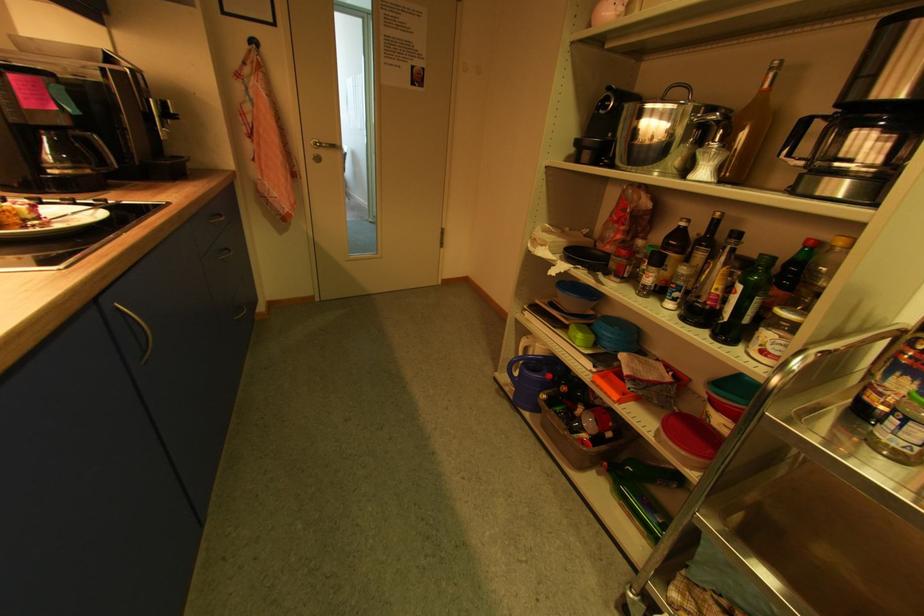
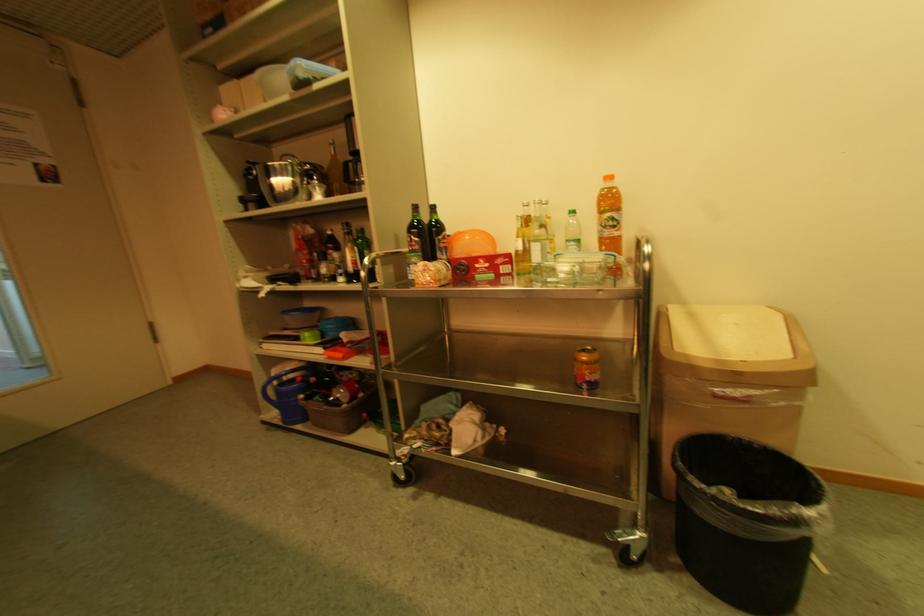
Question: The camera is either moving clockwise (left) or counter-clockwise (right) around the object. The first image is from the beginning of the video and the second image is from the end. Is the camera moving left or right when shooting the video?

Choices:
 (A) Left
 (B) Right

Answer: (A)